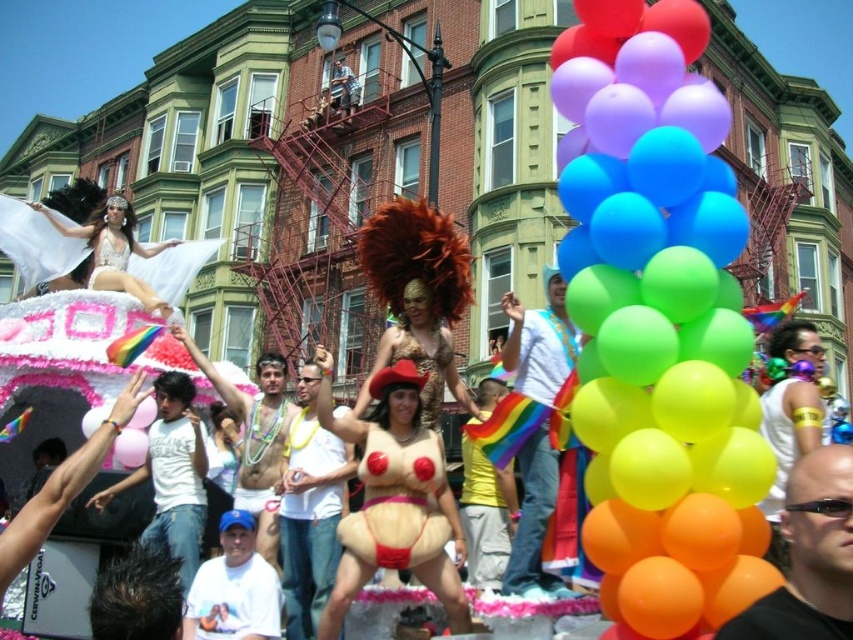
Is point (369, 561) behind point (442, 337)?

No, (369, 561) is closer to viewer.

Does velvet pink lingerie at center lie behind matte gold dress at center?

That is False.

Who is more forward, (413, 444) or (450, 355)?

Point (413, 444)

Locate an element on the screen. The height and width of the screenshot is (640, 853). velvet pink lingerie at center is located at coordinates 397,502.

Can you confirm if matte red wig at center is positioned to the left of matte gold dress at center?

Yes, matte red wig at center is to the left of matte gold dress at center.

Which of these two, matte red wig at center or matte gold dress at center, stands shorter?

With less height is matte gold dress at center.

Is point (405, 499) farther from viewer compared to point (432, 380)?

No, it is in front of (432, 380).

Where is `matte red wig at center`? Image resolution: width=853 pixels, height=640 pixels. matte red wig at center is located at coordinates (392, 496).

Is point (404, 362) farther from viewer compared to point (129, 237)?

No.

Between point (439, 518) and point (120, 285), which one is positioned behind?

Positioned behind is point (120, 285).

Where is `matte red wig at center`? The height and width of the screenshot is (640, 853). matte red wig at center is located at coordinates (392, 496).